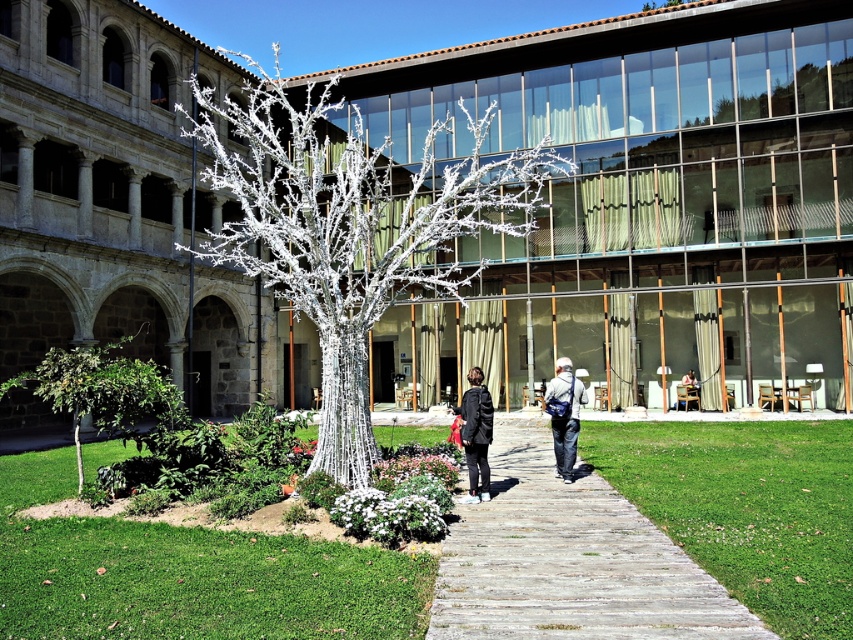
You are standing at the entrance of the courtyard and want to find the silver metallic tree at center. According to the coordinates provided, where should you look relative to the entrance?

The silver metallic tree at center is located at coordinates 0.358 on the x axis and 0.415 on the y axis, so you should look towards the center of the courtyard slightly to the right and forward from the entrance.

You are standing in the courtyard and see the silver metallic tree at center and the dark gray fabric jacket at center. Which object is higher from the ground?

The silver metallic tree at center is located above the dark gray fabric jacket at center, so the silver metallic tree at center is higher from the ground.

You are standing in the courtyard and want to place the matte black backpack at center near the silver metallic tree at center. Considering their sizes, will the backpack be easily visible next to the tree?

The silver metallic tree at center is larger than the matte black backpack at center, so the backpack may be partially obscured but still somewhat visible depending on placement.